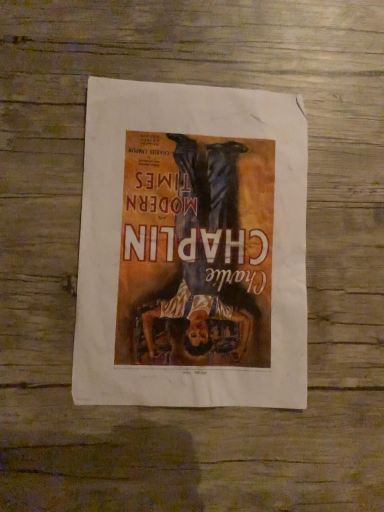
What do you see at coordinates (192, 248) in the screenshot? I see `matte paper poster at center` at bounding box center [192, 248].

The height and width of the screenshot is (512, 384). Find the location of `matte paper poster at center`. matte paper poster at center is located at coordinates (192, 248).

At what (x,y) coordinates should I click in order to perform the action: click on matte paper poster at center. Please return your answer as a coordinate pair (x, y). The height and width of the screenshot is (512, 384). Looking at the image, I should click on (192, 248).